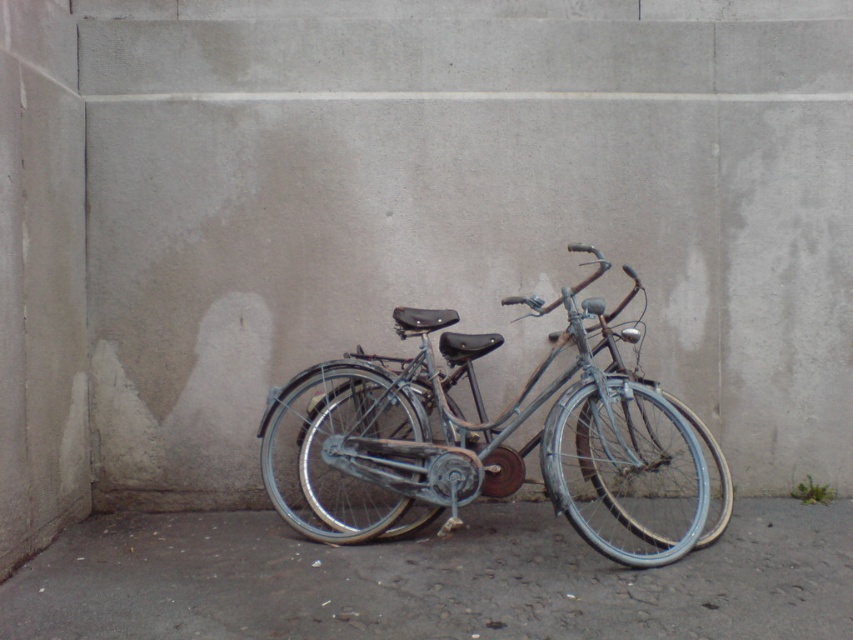
Question: Is gray concrete at lower center positioned behind blue metallic bicycle at center?

Choices:
 (A) no
 (B) yes

Answer: (A)

Question: Which point is farther to the camera?

Choices:
 (A) gray concrete at lower center
 (B) blue metallic bicycle at center

Answer: (B)

Question: Does gray concrete at lower center have a smaller size compared to blue metallic bicycle at center?

Choices:
 (A) yes
 (B) no

Answer: (A)

Question: Which point is farther to the camera?

Choices:
 (A) (178, 634)
 (B) (358, 429)

Answer: (B)

Question: Is gray concrete at lower center thinner than blue metallic bicycle at center?

Choices:
 (A) yes
 (B) no

Answer: (B)